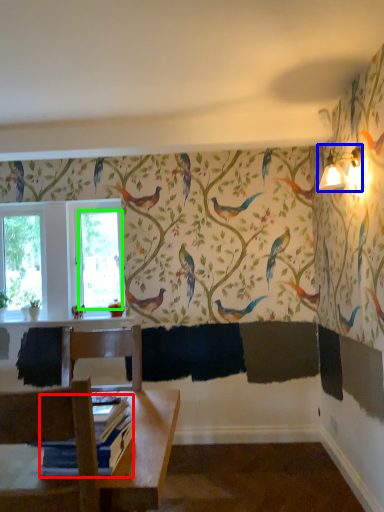
Question: Considering the real-world distances, which object is farthest from book (highlighted by a red box)? light fixture (highlighted by a blue box) or window screen (highlighted by a green box)?

Choices:
 (A) light fixture
 (B) window screen

Answer: (B)